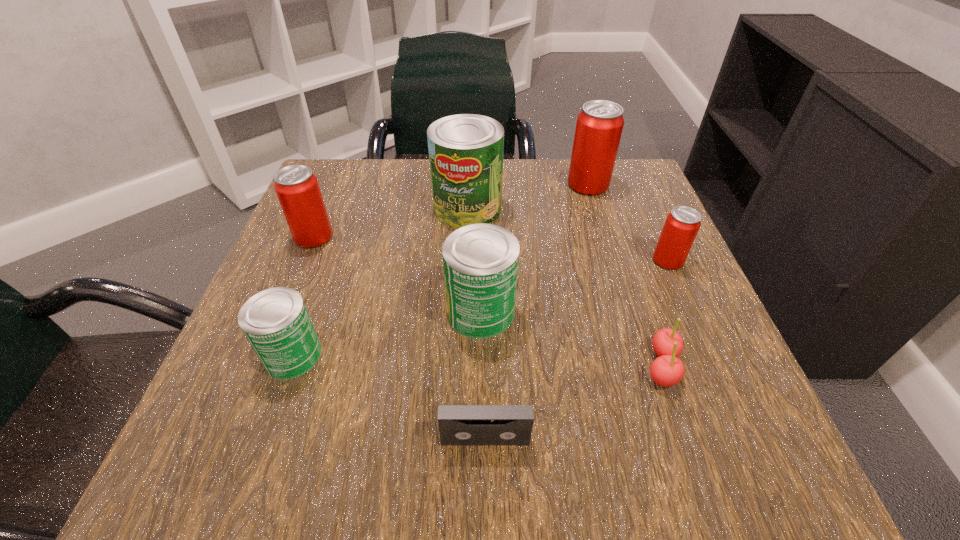
The height and width of the screenshot is (540, 960). I want to click on videotape, so click(x=459, y=425).

Identify the location of free spot located on the left of the second red can from left to right. (519, 185).

The image size is (960, 540). What are the coordinates of `vacant region located on the front of the farthest green can` in the screenshot? It's located at (466, 269).

At what (x,y) coordinates should I click in order to perform the action: click on blank area located on the right of the second smallest red can. Please return your answer as a coordinate pair (x, y). The image size is (960, 540). Looking at the image, I should click on (529, 237).

You are a GUI agent. You are given a task and a screenshot of the screen. Output one action in this format:
    pyautogui.click(x=<x>, y=<y>)
    Task: Click on the free spot located 0.050m on the back of the second smallest green can
    
    Given the screenshot: What is the action you would take?
    pyautogui.click(x=481, y=267)

This screenshot has width=960, height=540. I want to click on vacant area located on the front of the rightmost can, so click(x=707, y=347).

The height and width of the screenshot is (540, 960). In order to click on blank space located 0.080m on the back of the smallest green can in this screenshot , I will do `click(315, 296)`.

The width and height of the screenshot is (960, 540). I want to click on vacant space located 0.220m on the left of the red cherry, so click(496, 366).

Find the location of `object that is at the near edge`. object that is at the near edge is located at coordinates (459, 425).

The width and height of the screenshot is (960, 540). Find the location of `cherry located in the right edge section of the desktop`. cherry located in the right edge section of the desktop is located at coordinates (667, 370).